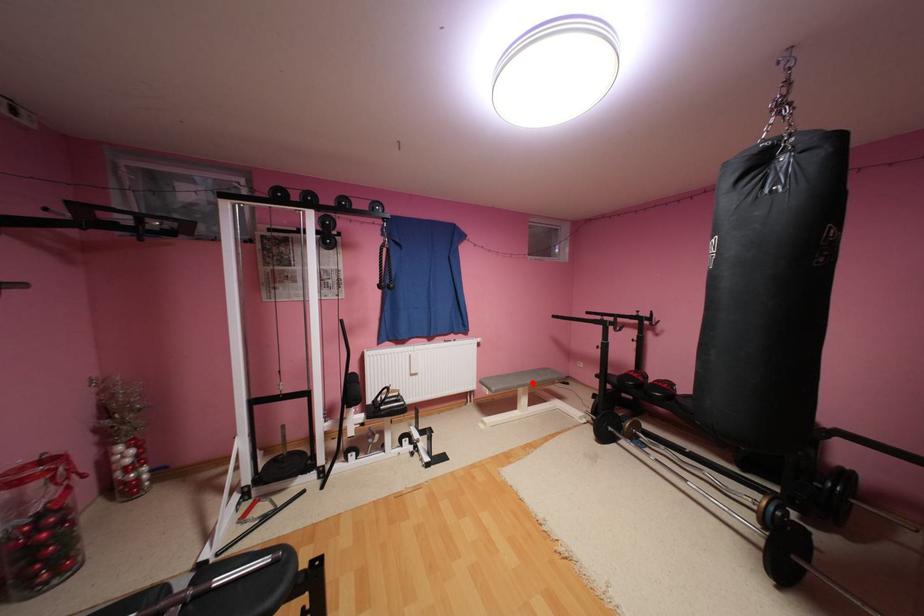
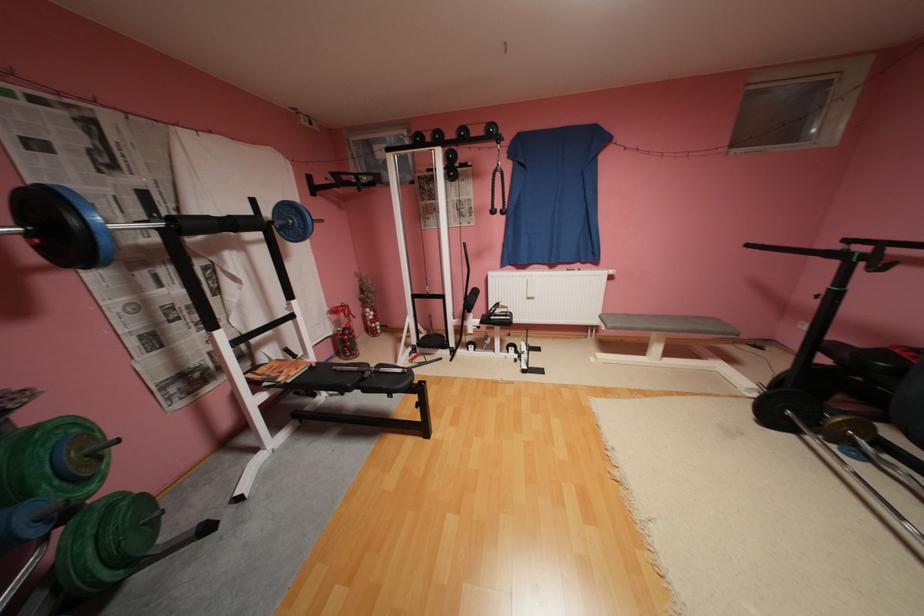
Where in the second image is the point corresponding to the highlighted location from the first image?

(664, 326)